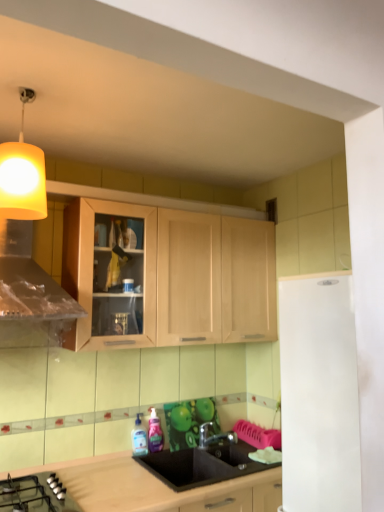
Question: Is white matte refrigerator at right surrounding yellow fabric lampshade at upper left?

Choices:
 (A) no
 (B) yes

Answer: (A)

Question: Are white matte refrigerator at right and yellow fabric lampshade at upper left far apart?

Choices:
 (A) no
 (B) yes

Answer: (B)

Question: Is white matte refrigerator at right oriented towards yellow fabric lampshade at upper left?

Choices:
 (A) yes
 (B) no

Answer: (B)

Question: Does white matte refrigerator at right appear on the right side of yellow fabric lampshade at upper left?

Choices:
 (A) yes
 (B) no

Answer: (A)

Question: Is white matte refrigerator at right positioned with its back to yellow fabric lampshade at upper left?

Choices:
 (A) yes
 (B) no

Answer: (B)

Question: Is white matte refrigerator at right at the left side of yellow fabric lampshade at upper left?

Choices:
 (A) yes
 (B) no

Answer: (B)

Question: Is black matte sink at center wider than black glass gas stove at lower left?

Choices:
 (A) yes
 (B) no

Answer: (B)

Question: Does black matte sink at center appear on the right side of black glass gas stove at lower left?

Choices:
 (A) no
 (B) yes

Answer: (B)

Question: Is black matte sink at center oriented away from black glass gas stove at lower left?

Choices:
 (A) no
 (B) yes

Answer: (A)

Question: Can black glass gas stove at lower left be found inside black matte sink at center?

Choices:
 (A) no
 (B) yes

Answer: (A)

Question: Is black matte sink at center bigger than black glass gas stove at lower left?

Choices:
 (A) yes
 (B) no

Answer: (A)

Question: Is the position of black matte sink at center more distant than that of black glass gas stove at lower left?

Choices:
 (A) no
 (B) yes

Answer: (B)

Question: Is transparent plastic bottle at sink, marked as the 2th bottle in a right-to-left arrangement, taller than white matte refrigerator at right?

Choices:
 (A) no
 (B) yes

Answer: (A)